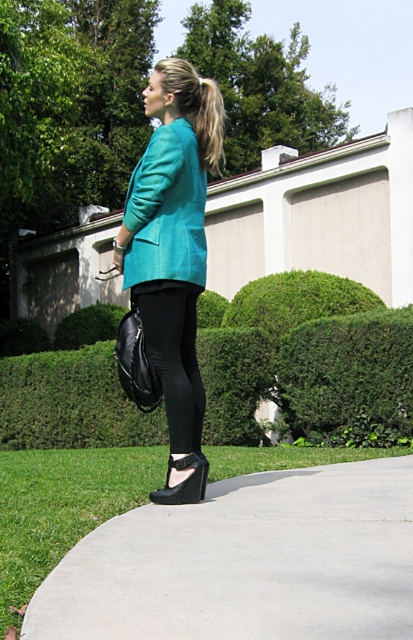
How distant is black smooth leggings at center from blonde hair at upper center?

black smooth leggings at center and blonde hair at upper center are 3.87 feet apart.

Can you confirm if black smooth leggings at center is bigger than blonde hair at upper center?

Yes, black smooth leggings at center is bigger than blonde hair at upper center.

Who is more distant from viewer, (182,348) or (216,99)?

Point (182,348)

Find the location of `black smooth leggings at center`. black smooth leggings at center is located at coordinates (173, 355).

Which of these two, teal fabric blazer at center or teal fabric jacket at center, stands shorter?

teal fabric jacket at center is shorter.

The height and width of the screenshot is (640, 413). I want to click on teal fabric blazer at center, so click(173, 253).

Which is in front, point (313, 582) or point (197, 84)?

Point (313, 582) is in front.

How distant is gray concrete pavement at lower center from blonde hair at upper center?

gray concrete pavement at lower center and blonde hair at upper center are 2.41 meters apart from each other.

I want to click on gray concrete pavement at lower center, so click(x=246, y=563).